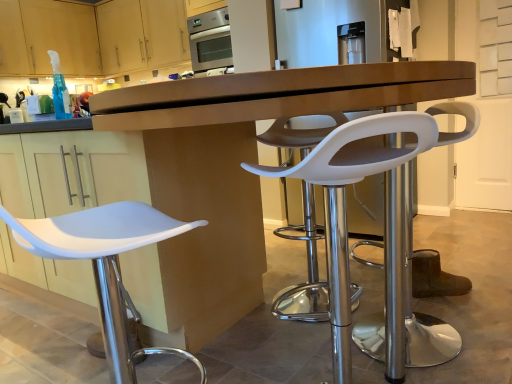
The image size is (512, 384). I want to click on free space to the back side of white plastic stool at center, which is counted as the 3th chair, starting from the left, so click(x=379, y=300).